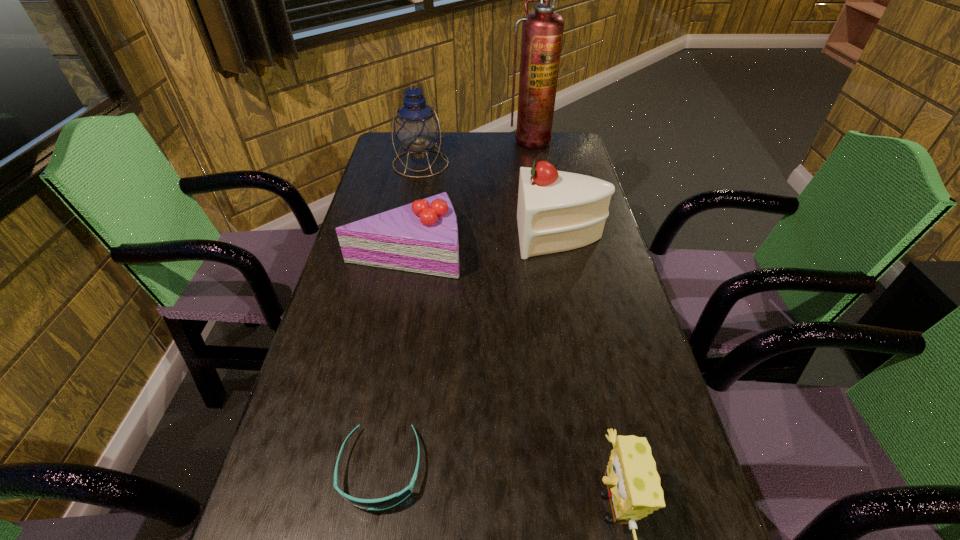
The height and width of the screenshot is (540, 960). Find the location of `the tallest object`. the tallest object is located at coordinates (542, 31).

The image size is (960, 540). Find the location of `lantern`. lantern is located at coordinates (417, 128).

The width and height of the screenshot is (960, 540). What are the coordinates of `the taller cake` in the screenshot? It's located at (557, 211).

Find the location of a particular element. The height and width of the screenshot is (540, 960). the third tallest object is located at coordinates (557, 211).

Find the location of `the shorter cake`. the shorter cake is located at coordinates (422, 237).

The height and width of the screenshot is (540, 960). In order to click on the shortest object in this screenshot , I will do click(x=387, y=502).

Locate an element on the screen. vacant space located on the side of the fire extinguisher with the label is located at coordinates (533, 159).

This screenshot has height=540, width=960. Find the location of `vacant space positioned on the front-facing side of the lantern`. vacant space positioned on the front-facing side of the lantern is located at coordinates (415, 193).

Locate an element on the screen. This screenshot has height=540, width=960. vacant space located 0.280m on the back of the taller cake is located at coordinates (547, 168).

The width and height of the screenshot is (960, 540). In order to click on free point located on the right of the left cake in this screenshot , I will do `click(595, 251)`.